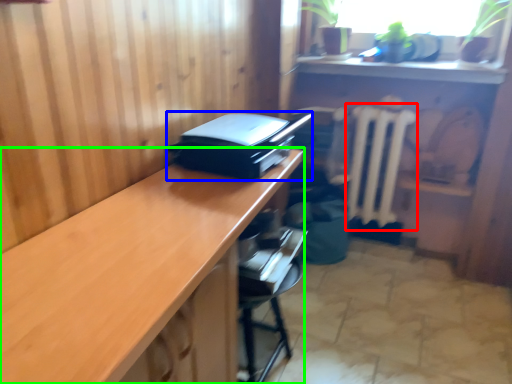
Question: Considering the real-world distances, which object is closest to radiator (highlighted by a red box)? printer (highlighted by a blue box) or desk (highlighted by a green box).

Choices:
 (A) printer
 (B) desk

Answer: (A)